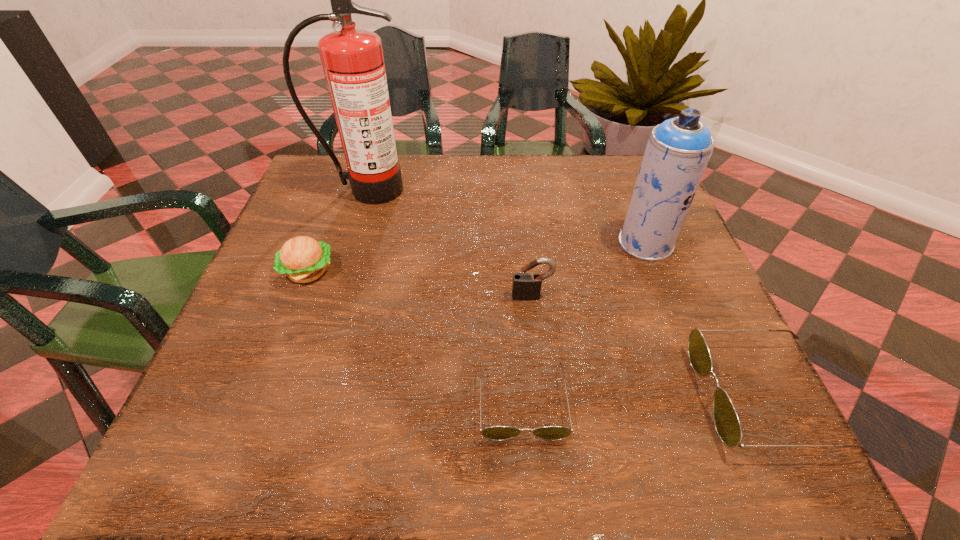
Please show where to add a sunglasses on the left while keeping spacing even. Please provide its 2D coordinates. Your answer should be formatted as a tuple, i.e. [(x, y)], where the tuple contains the x and y coordinates of a point satisfying the conditions above.

[(277, 406)]